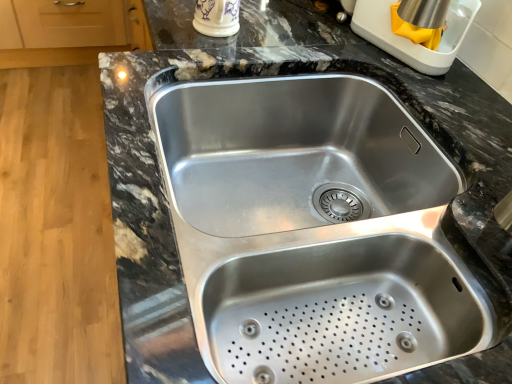
Where is `vacant area in front of stainless steel kettle at upper right, the second appliance when ordered from left to right`? The image size is (512, 384). vacant area in front of stainless steel kettle at upper right, the second appliance when ordered from left to right is located at coordinates (451, 102).